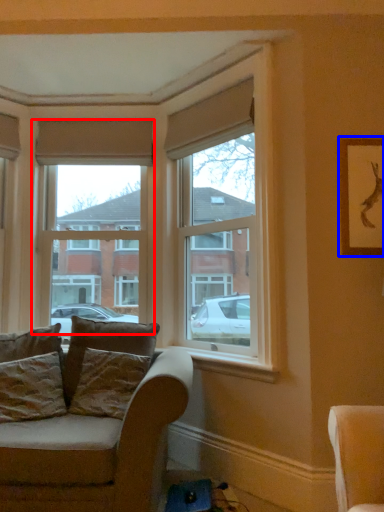
Question: Which object is closer to the camera taking this photo, window (highlighted by a red box) or picture frame (highlighted by a blue box)?

Choices:
 (A) window
 (B) picture frame

Answer: (B)